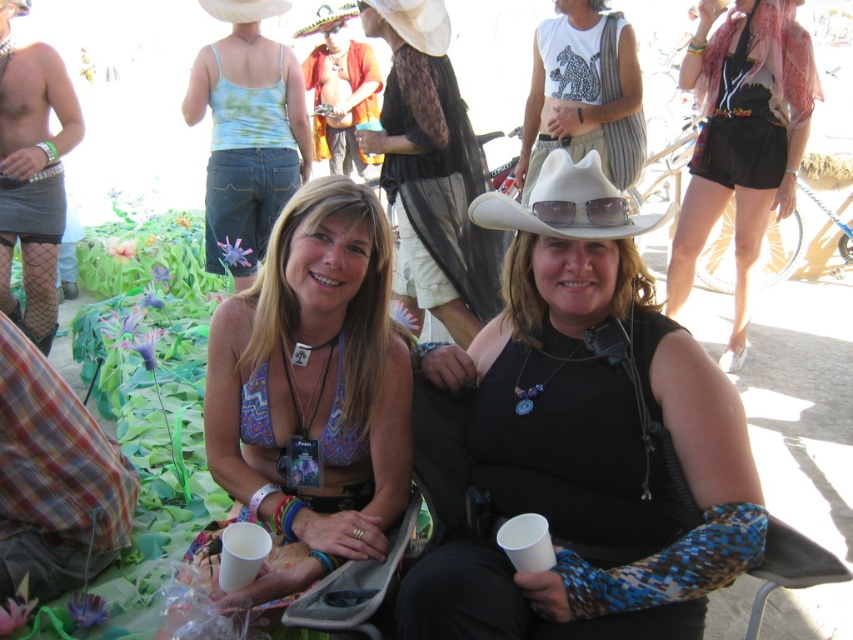
Who is more distant from viewer, (427, 236) or (305, 35)?

The point (305, 35) is more distant.

Is point (412, 262) farther from viewer compared to point (291, 36)?

No, (412, 262) is closer to viewer.

Find the location of `black lace top at center`. black lace top at center is located at coordinates (432, 168).

Is point (773, 204) positioned in front of point (387, 3)?

No, it is not.

Does black cotton shorts at center come in front of white fabric hat at upper center?

No, it is not.

The image size is (853, 640). Identify the location of black cotton shorts at center. (741, 140).

The height and width of the screenshot is (640, 853). Find the location of `black cotton shorts at center`. black cotton shorts at center is located at coordinates (741, 140).

Between matte black shirt at center and multicolored felt sombrero at upper center, which one is positioned lower?

matte black shirt at center

Can you confirm if matte black shirt at center is positioned below multicolored felt sombrero at upper center?

Correct, matte black shirt at center is located below multicolored felt sombrero at upper center.

Image resolution: width=853 pixels, height=640 pixels. Find the location of `matte black shirt at center`. matte black shirt at center is located at coordinates (584, 440).

I want to click on matte black shirt at center, so click(x=584, y=440).